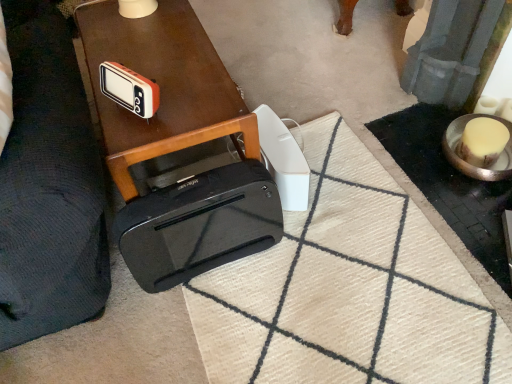
Question: From a real-world perspective, is orange plastic radio at upper left, which is the 1th gadget from left to right, physically located above or below shiny brown table at center?

Choices:
 (A) below
 (B) above

Answer: (B)

Question: Looking at the image, does orange plastic radio at upper left, which is the 1th gadget from left to right, seem bigger or smaller compared to shiny brown table at center?

Choices:
 (A) big
 (B) small

Answer: (B)

Question: Considering the real-world distances, which object is closest to the orange plastic radio at upper left, which is the 1th gadget from left to right?

Choices:
 (A) shiny brown table at center
 (B) white plastic remote control at center, which is the 2th gadget from left to right
 (C) dark blue fabric couch at left
 (D) beige textured doormat at center

Answer: (A)

Question: Estimate the real-world distances between objects in this image. Which object is farther from the white plastic remote control at center, which is the 2th gadget from left to right?

Choices:
 (A) orange plastic radio at upper left, which is the 1th gadget from left to right
 (B) dark blue fabric couch at left
 (C) beige textured doormat at center
 (D) shiny brown table at center

Answer: (B)